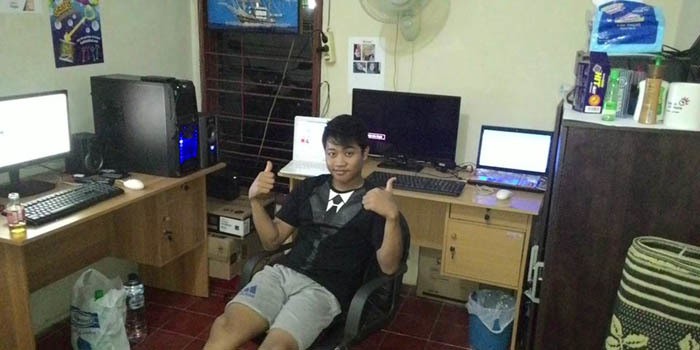
At what (x,y) coordinates should I click in order to perform the action: click on computer screen. Please return your answer as a coordinate pair (x, y). The image size is (700, 350). Looking at the image, I should click on (21, 126).